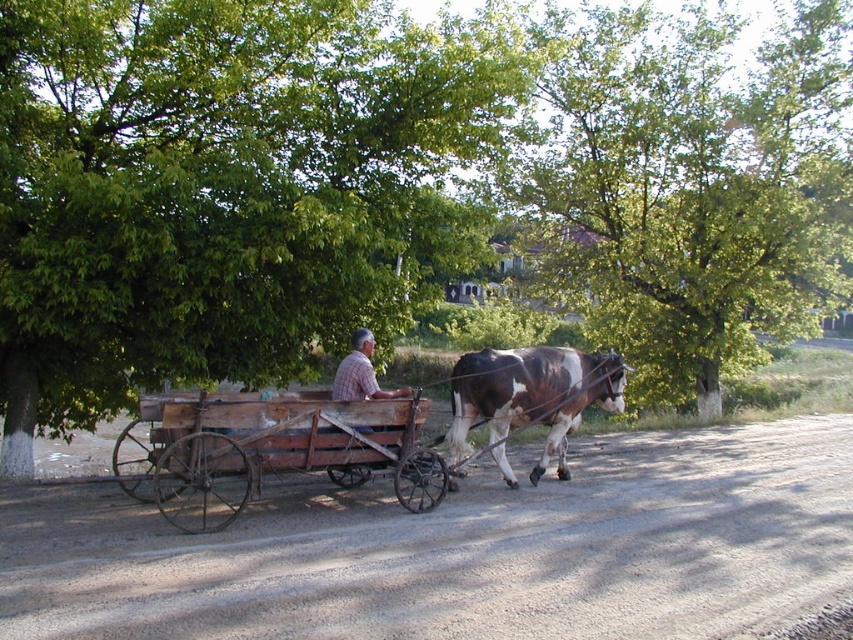
Between point (312, 161) and point (340, 369), which one is positioned behind?

The point (312, 161) is more distant.

Where is `green leafy tree at upper left`? green leafy tree at upper left is located at coordinates (221, 188).

You are a GUI agent. You are given a task and a screenshot of the screen. Output one action in this format:
    pyautogui.click(x=<x>, y=<y>)
    Task: Click on the green leafy tree at upper left
    
    Given the screenshot: What is the action you would take?
    pyautogui.click(x=221, y=188)

Looking at this image, is green leafy tree at upper left bigger than green leafy tree at center?

No, green leafy tree at upper left is not bigger than green leafy tree at center.

Is green leafy tree at upper left taller than green leafy tree at center?

In fact, green leafy tree at upper left may be shorter than green leafy tree at center.

Where is `green leafy tree at upper left`? green leafy tree at upper left is located at coordinates (221, 188).

Which is below, rustic wood wagon at center or brown and white fur at center?

rustic wood wagon at center is below.

Which is more to the right, rustic wood wagon at center or brown and white fur at center?

Positioned to the right is brown and white fur at center.

The image size is (853, 640). I want to click on rustic wood wagon at center, so click(271, 451).